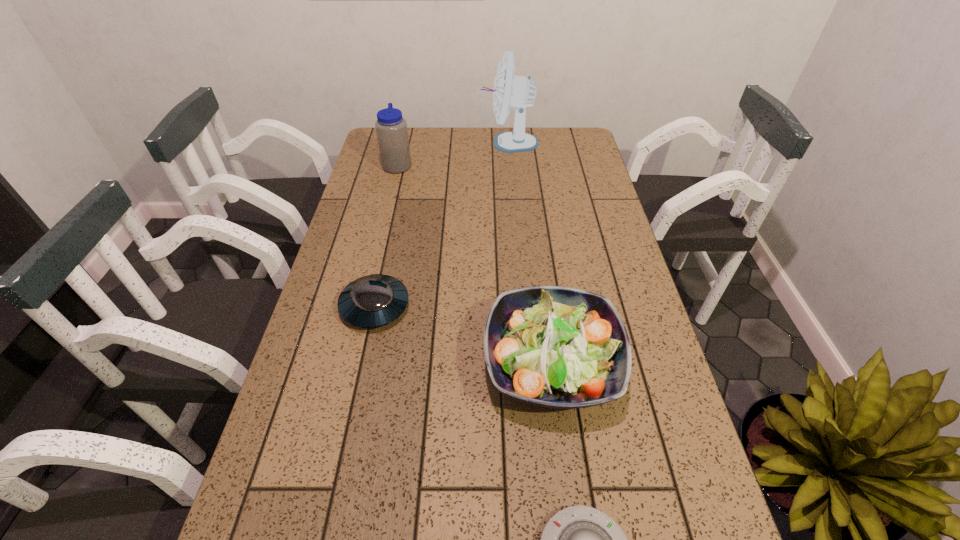
Find the location of a particular element. free point located on the front of the taller saucer is located at coordinates (361, 370).

Identify the location of fan present at the far edge. The height and width of the screenshot is (540, 960). (518, 92).

Locate an element on the screen. The image size is (960, 540). water bottle present at the far edge is located at coordinates (391, 128).

Where is `water bottle that is at the left edge`? The height and width of the screenshot is (540, 960). water bottle that is at the left edge is located at coordinates (391, 128).

I want to click on saucer located at the left edge, so click(x=371, y=301).

Image resolution: width=960 pixels, height=540 pixels. I want to click on object at the right edge, so click(x=551, y=346).

Where is `object at the far left corner`? object at the far left corner is located at coordinates (391, 128).

You are a GUI agent. You are given a task and a screenshot of the screen. Output one action in this format:
    pyautogui.click(x=<x>, y=<y>)
    Task: Click on the vacant point at the far edge
    This screenshot has height=540, width=960.
    Given the screenshot: What is the action you would take?
    pyautogui.click(x=472, y=129)

This screenshot has width=960, height=540. What are the coordinates of `vacant space at the left edge of the desktop` in the screenshot? It's located at (298, 438).

I want to click on vacant space at the right edge, so click(x=598, y=194).